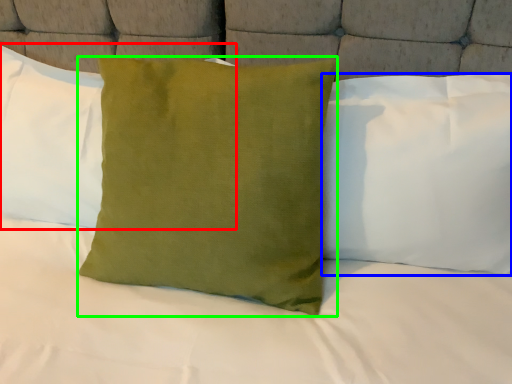
Question: Based on their relative distances, which object is nearer to pillow (highlighted by a red box)? Choose from pillow (highlighted by a blue box) and pillow (highlighted by a green box).

Choices:
 (A) pillow
 (B) pillow

Answer: (B)